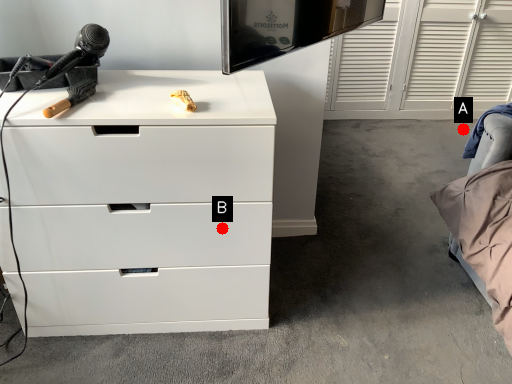
Question: Two points are circled on the image, labeled by A and B beside each circle. Among these points, which one is nearest to the camera?

Choices:
 (A) A is closer
 (B) B is closer

Answer: (B)